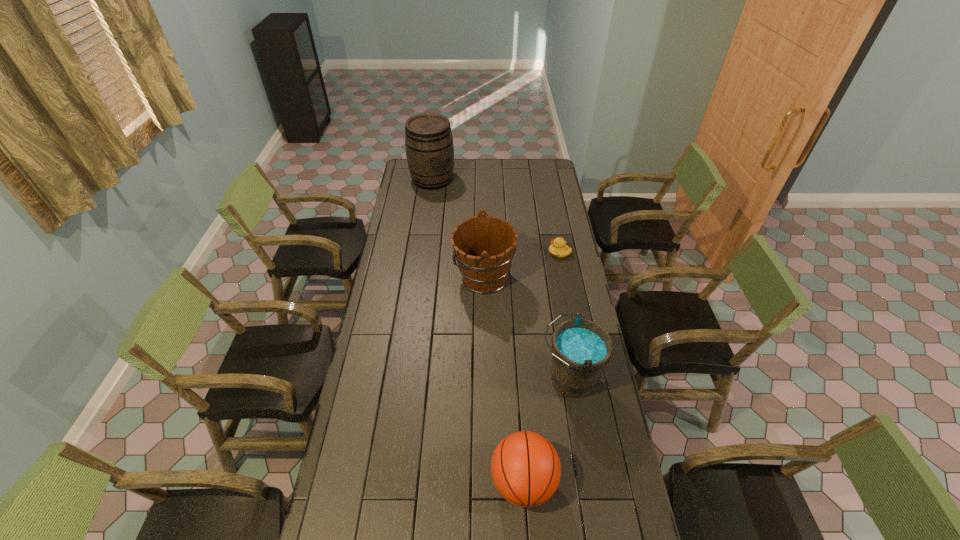
Locate an element on the screen. free space between the leftmost object and the second shortest object is located at coordinates (478, 330).

The image size is (960, 540). Find the location of `vacant area between the second farthest wine bucket and the rightmost wine bucket`. vacant area between the second farthest wine bucket and the rightmost wine bucket is located at coordinates (526, 328).

Find the location of a particular element. The width and height of the screenshot is (960, 540). free point between the second wine bucket from right to left and the duckling is located at coordinates (521, 265).

You are a GUI agent. You are given a task and a screenshot of the screen. Output one action in this format:
    pyautogui.click(x=<x>, y=<y>)
    Task: Click on the vacant space in between the nearest wine bucket and the second wine bucket from left to right
    The height and width of the screenshot is (540, 960).
    Given the screenshot: What is the action you would take?
    pyautogui.click(x=526, y=328)

Identify which object is the closest to the leftmost wine bucket. Please provide its 2D coordinates. Your answer should be formatted as a tuple, i.e. [(x, y)], where the tuple contains the x and y coordinates of a point satisfying the conditions above.

[(484, 247)]

Locate which object is the third closest to the second nearest object. Please provide its 2D coordinates. Your answer should be formatted as a tuple, i.e. [(x, y)], where the tuple contains the x and y coordinates of a point satisfying the conditions above.

[(558, 248)]

Identify which wine bucket is the nearest to the second wine bucket from right to left. Please provide its 2D coordinates. Your answer should be formatted as a tuple, i.e. [(x, y)], where the tuple contains the x and y coordinates of a point satisfying the conditions above.

[(581, 349)]

At what (x,y) coordinates should I click in order to perform the action: click on the closest wine bucket to the tallest wine bucket. Please return your answer as a coordinate pair (x, y). Looking at the image, I should click on (x=484, y=247).

Identify the location of free space in the image that satisfies the following two spatial constraints: 1. with a handle on the side of the nearest wine bucket; 2. on the front side of the nearest object. Image resolution: width=960 pixels, height=540 pixels. (586, 482).